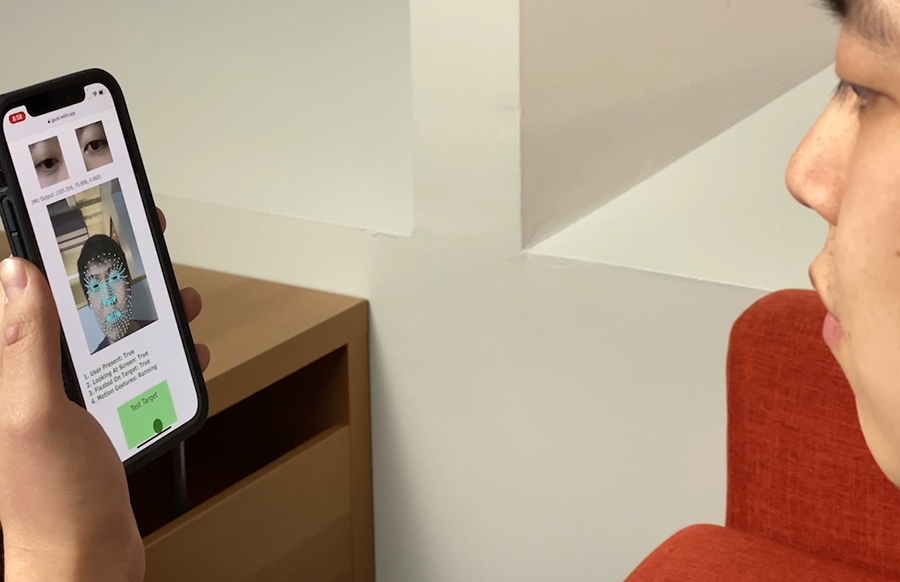
Locate an element on the screen. The height and width of the screenshot is (582, 900). chair is located at coordinates (742, 503).